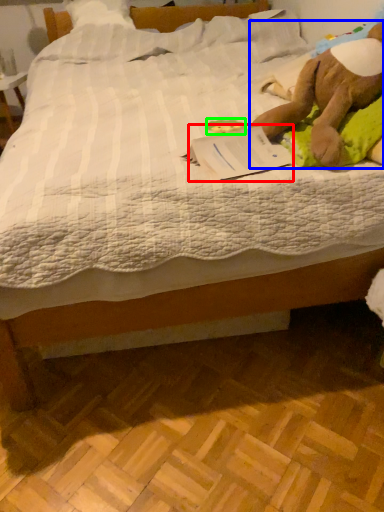
Question: Which object is positioned farthest from paperback book (highlighted by a red box)? Select from animal (highlighted by a blue box) and toy (highlighted by a green box).

Choices:
 (A) animal
 (B) toy

Answer: (B)